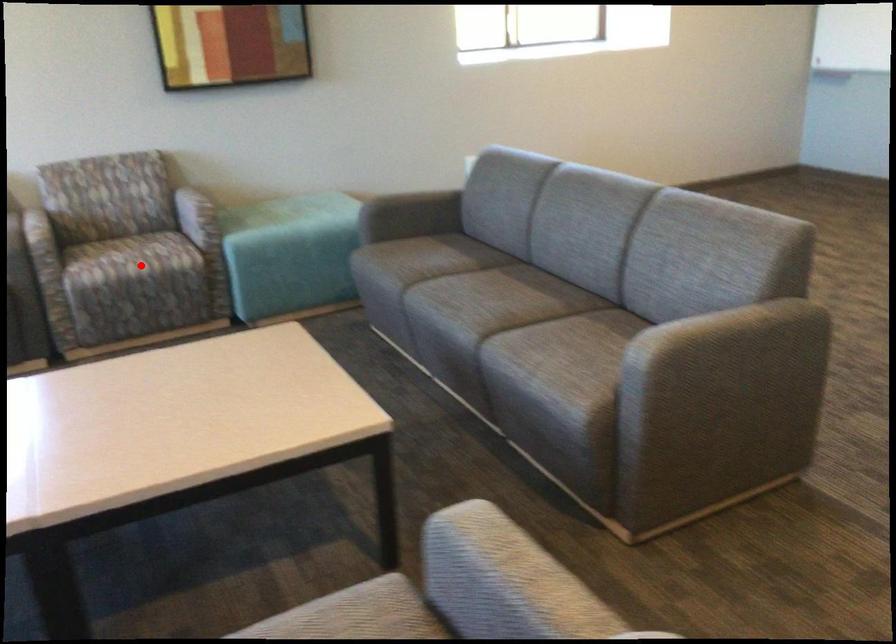
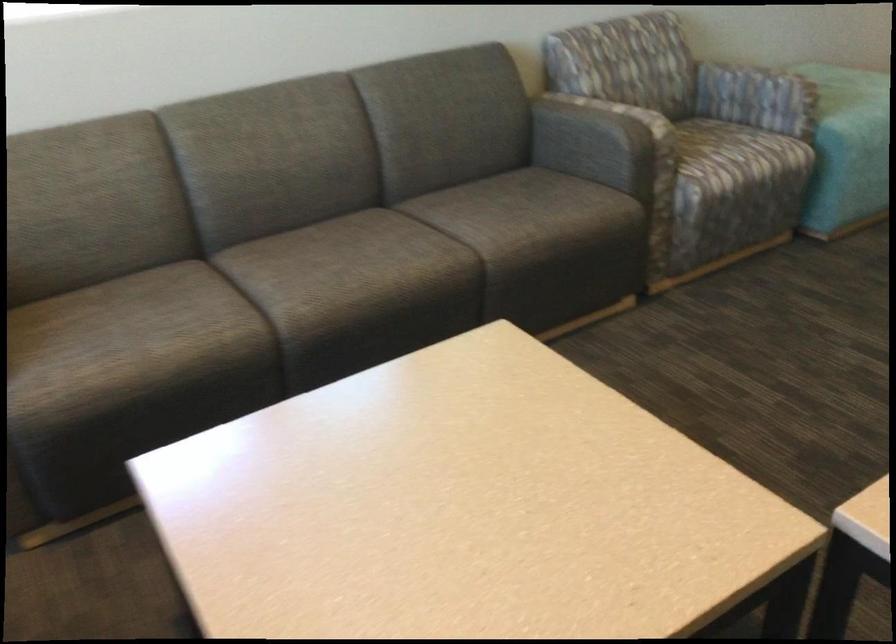
Question: I am providing you with two images of the same scene from different viewpoints. Image1 has a red point marked. In image2, the corresponding 3D location appears at what relative position? Reply with the corresponding letter.

Choices:
 (A) Closer
 (B) Farther

Answer: (A)